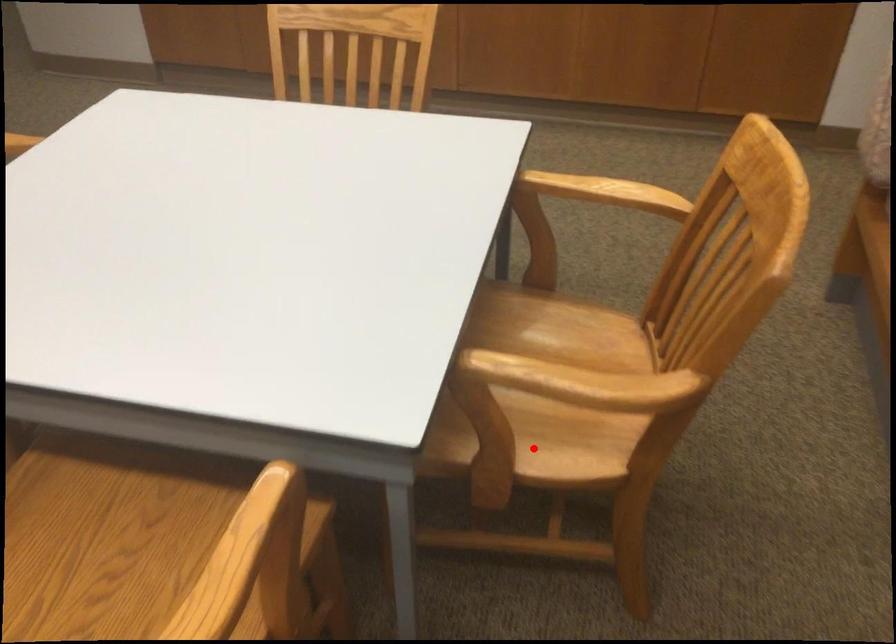
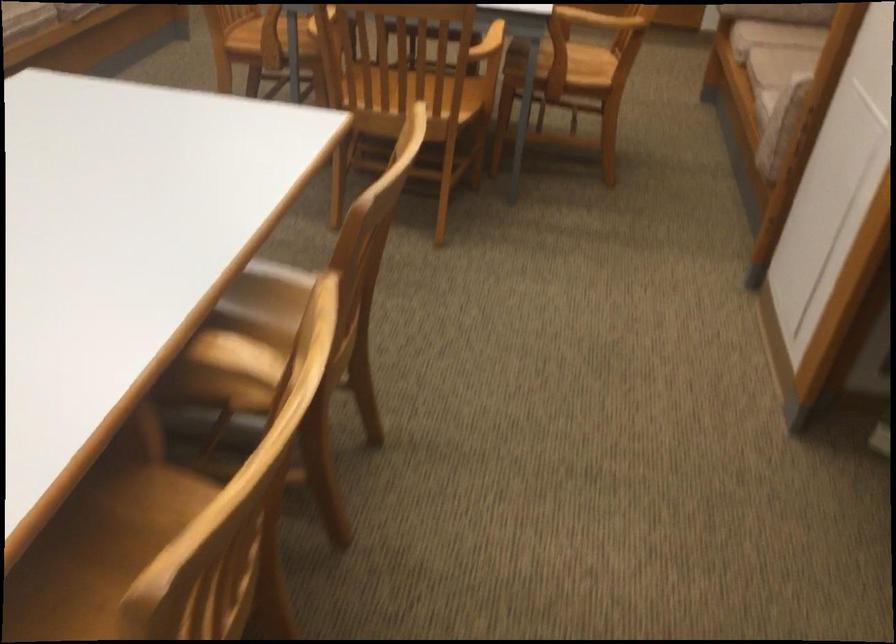
Question: I am providing you with two images of the same scene from different viewpoints. Given a red point in image1, look at the same physical point in image2. Is it:

Choices:
 (A) Closer to the viewpoint
 (B) Farther from the viewpoint

Answer: (B)